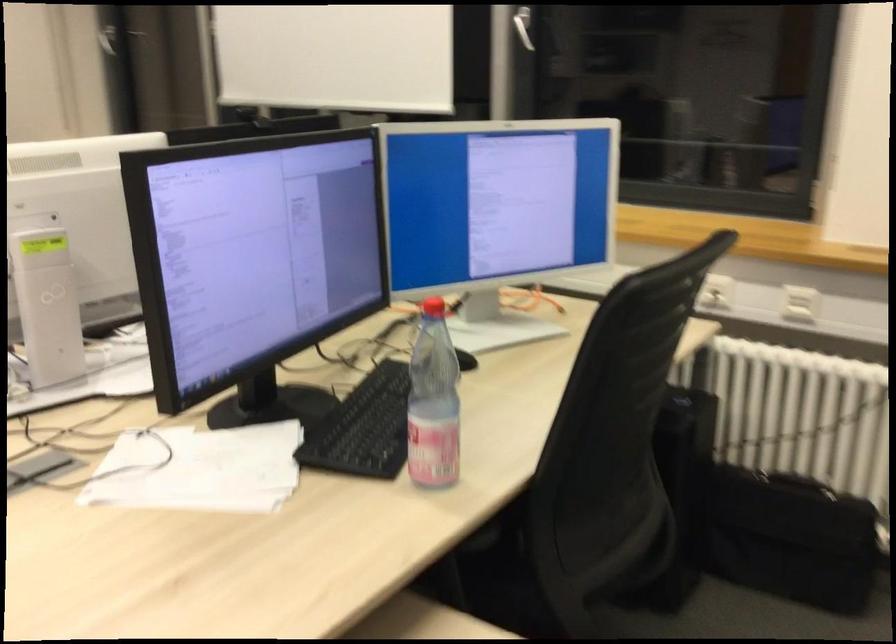
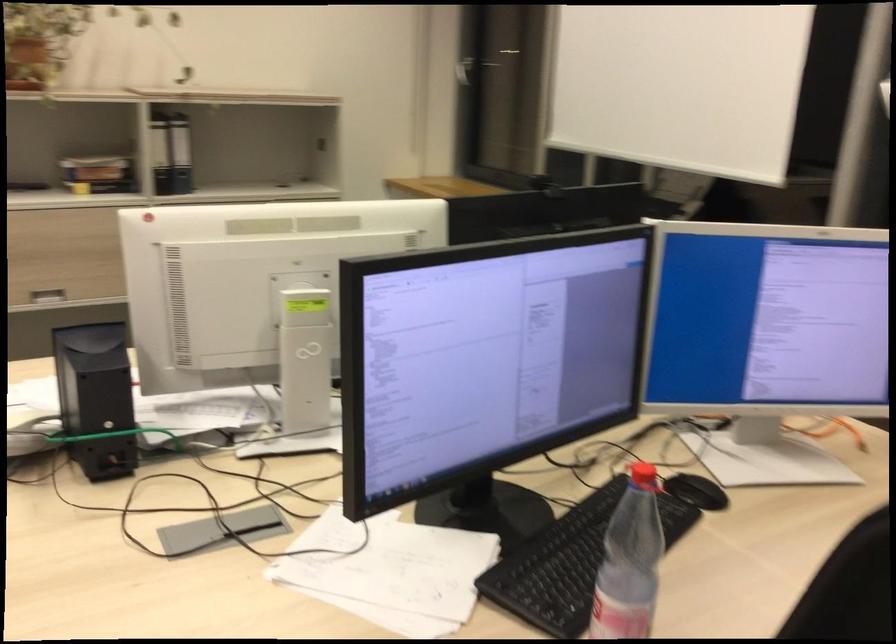
Locate, in the second image, the point that corresponds to point 453,357 in the first image.

(695, 491)